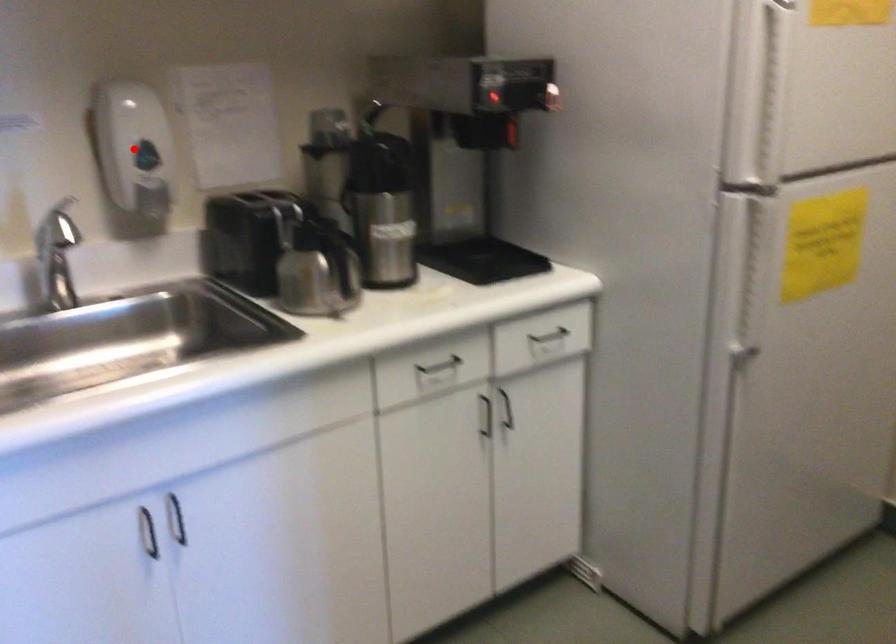
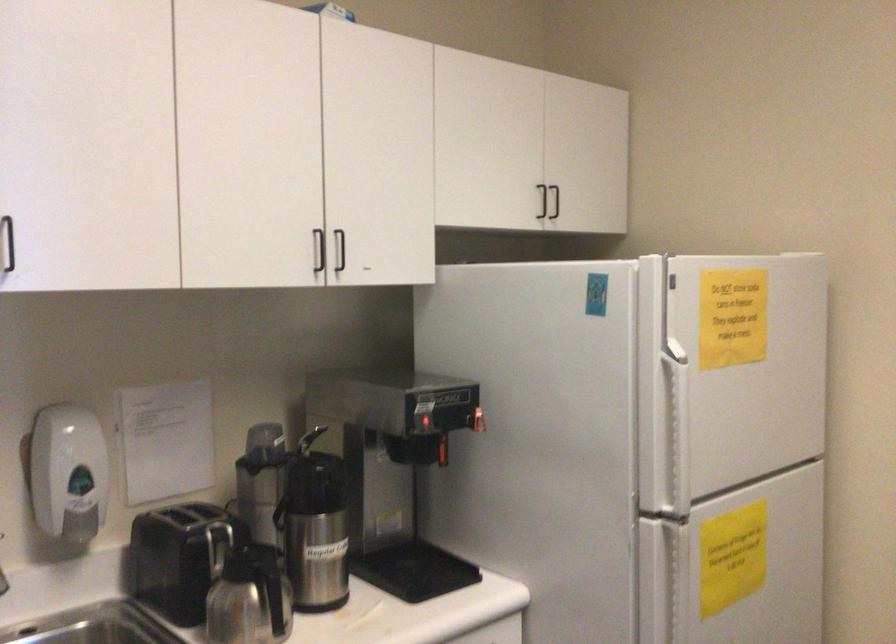
The point at the highlighted location is marked in the first image. Where is the corresponding point in the second image?

(67, 473)